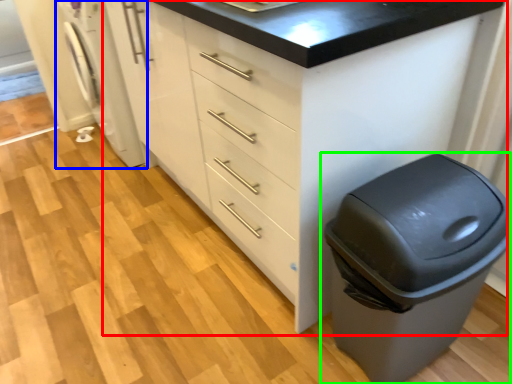
Question: Which object is positioned farthest from chest of drawers (highlighted by a red box)? Select from washing machine (highlighted by a blue box) and waste container (highlighted by a green box).

Choices:
 (A) washing machine
 (B) waste container

Answer: (A)